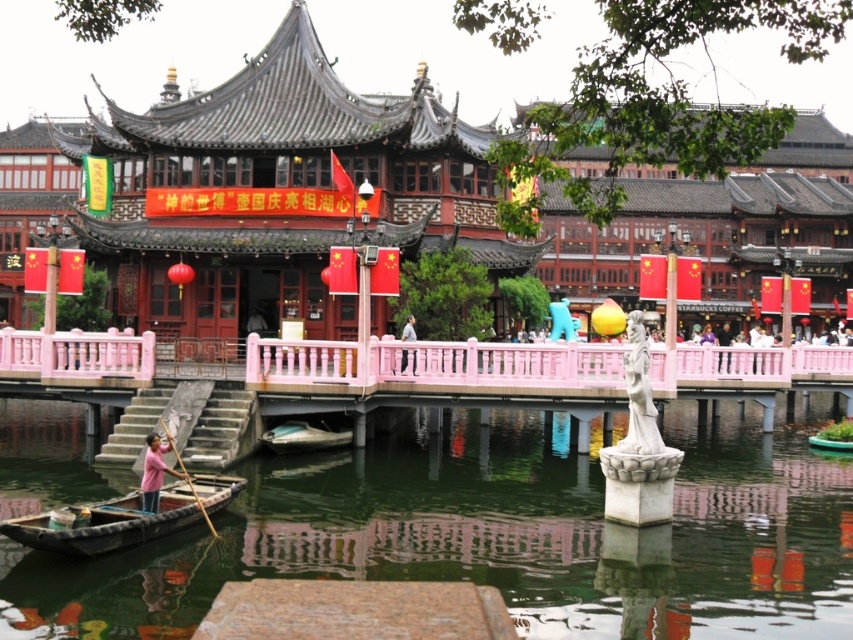
You are standing at the center of the pink bridge with railings that match the building aesthetic. You want to reach the wooden canoe at lower left. In which direction should you walk to get there?

To reach the wooden canoe at lower left, you should walk towards the lower left direction since the wooden canoe at lower left is located at point (106,524), which is in the lower left area of the scene.

Based on the photo, you are standing at the entrance of the traditional Chinese building and want to find the green reflective water at lower center. According to the coordinates provided, where should you look relative to the building?

The green reflective water at lower center is located at point coordinates 0.839 on the x axis and 0.583 on the y axis, so you should look towards the lower center direction relative to the building.

Based on the scene description, where is the wooden at left located in terms of its 2D coordinates?

The wooden at left is located at the 2D coordinates of point (189,481).